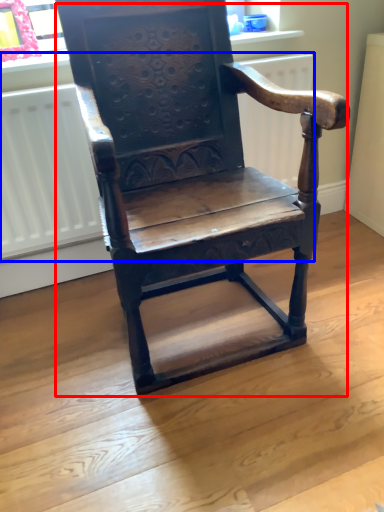
Question: Among these objects, which one is farthest to the camera, chair (highlighted by a red box) or radiator (highlighted by a blue box)?

Choices:
 (A) chair
 (B) radiator

Answer: (B)